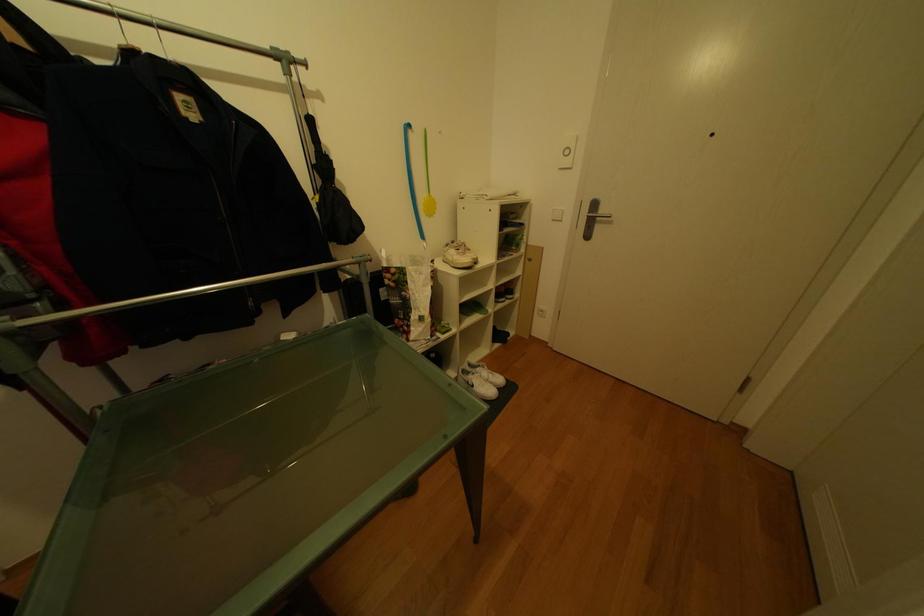
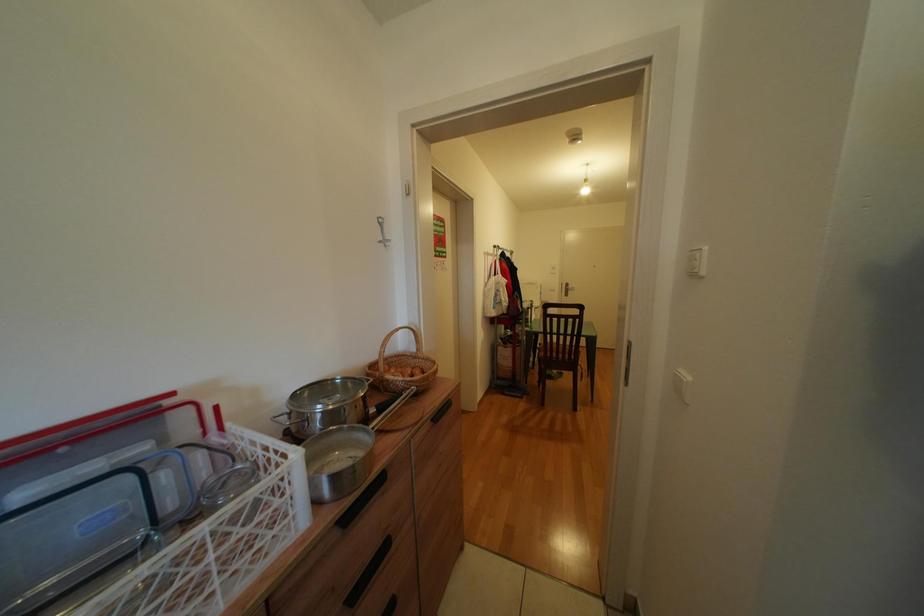
In a continuous first-person perspective shot, in which direction is the camera moving?

The movement direction of the cameraman is left, backward.